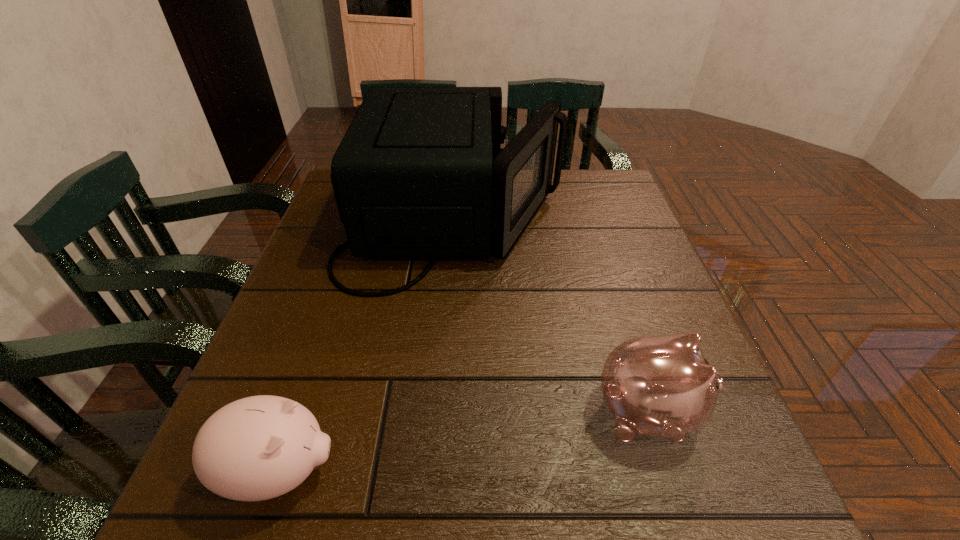
Identify the location of free space between the left piggy bank and the farthest object. (368, 346).

This screenshot has height=540, width=960. I want to click on free area in between the farthest object and the right piggy bank, so click(x=551, y=316).

Find the location of a particular element. empty location between the tallest object and the left piggy bank is located at coordinates (368, 346).

At what (x,y) coordinates should I click in order to perform the action: click on vacant region between the right piggy bank and the left piggy bank. Please return your answer as a coordinate pair (x, y). The image size is (960, 540). Looking at the image, I should click on (465, 442).

The width and height of the screenshot is (960, 540). Find the location of `vacant area that lies between the left piggy bank and the right piggy bank`. vacant area that lies between the left piggy bank and the right piggy bank is located at coordinates (465, 442).

The height and width of the screenshot is (540, 960). Find the location of `free space between the left piggy bank and the tallest object`. free space between the left piggy bank and the tallest object is located at coordinates (368, 346).

Where is `free point between the left piggy bank and the right piggy bank`? Image resolution: width=960 pixels, height=540 pixels. free point between the left piggy bank and the right piggy bank is located at coordinates (465, 442).

You are a GUI agent. You are given a task and a screenshot of the screen. Output one action in this format:
    pyautogui.click(x=<x>, y=<y>)
    Task: Click on the empty location between the right piggy bank and the left piggy bank
    The image size is (960, 540).
    Given the screenshot: What is the action you would take?
    pyautogui.click(x=465, y=442)

Locate an element on the screen. Image resolution: width=960 pixels, height=540 pixels. vacant space that's between the right piggy bank and the farthest object is located at coordinates [551, 316].

The height and width of the screenshot is (540, 960). I want to click on object that is the second closest one to the right piggy bank, so click(257, 448).